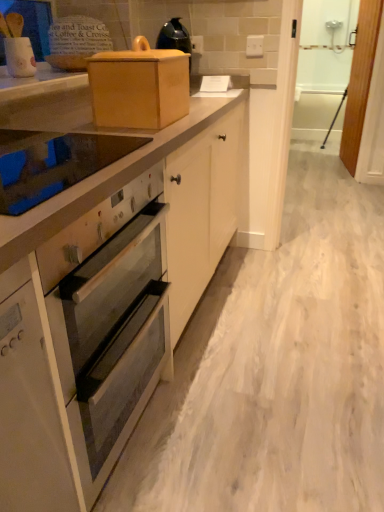
Question: Does white wood screen door at right, which ranks as the 1th screen door in left-to-right order, have a larger size compared to wooden box at upper center?

Choices:
 (A) yes
 (B) no

Answer: (A)

Question: Could you tell me if white wood screen door at right, which ranks as the 1th screen door in left-to-right order, is facing wooden box at upper center?

Choices:
 (A) yes
 (B) no

Answer: (A)

Question: Is white wood screen door at right, marked as the 2th screen door in a right-to-left arrangement, beside wooden box at upper center?

Choices:
 (A) yes
 (B) no

Answer: (B)

Question: Is white wood screen door at right, marked as the 2th screen door in a right-to-left arrangement, closer to camera compared to wooden box at upper center?

Choices:
 (A) no
 (B) yes

Answer: (A)

Question: From a real-world perspective, is white wood screen door at right, which ranks as the 1th screen door in left-to-right order, located beneath wooden box at upper center?

Choices:
 (A) yes
 (B) no

Answer: (A)

Question: Is white wood screen door at right, marked as the 2th screen door in a right-to-left arrangement, taller than wooden box at upper center?

Choices:
 (A) no
 (B) yes

Answer: (B)

Question: Does wooden box at upper center have a larger size compared to glass smooth cooktop at upper left?

Choices:
 (A) yes
 (B) no

Answer: (A)

Question: Is wooden box at upper center with glass smooth cooktop at upper left?

Choices:
 (A) yes
 (B) no

Answer: (B)

Question: Can we say wooden box at upper center lies outside glass smooth cooktop at upper left?

Choices:
 (A) no
 (B) yes

Answer: (B)

Question: Does wooden box at upper center have a greater width compared to glass smooth cooktop at upper left?

Choices:
 (A) yes
 (B) no

Answer: (B)

Question: From the image's perspective, is wooden box at upper center under glass smooth cooktop at upper left?

Choices:
 (A) yes
 (B) no

Answer: (B)

Question: Does wooden box at upper center appear on the left side of glass smooth cooktop at upper left?

Choices:
 (A) yes
 (B) no

Answer: (B)

Question: Can you confirm if white wood screen door at right, marked as the 2th screen door in a right-to-left arrangement, is positioned to the left of glass smooth cooktop at upper left?

Choices:
 (A) yes
 (B) no

Answer: (B)